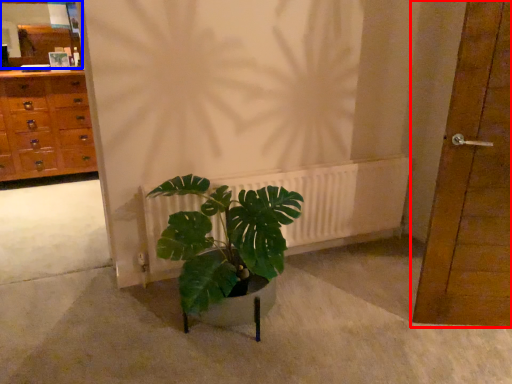
Question: Which of the following is the closest to the observer, door (highlighted by a red box) or mirror (highlighted by a blue box)?

Choices:
 (A) door
 (B) mirror

Answer: (A)